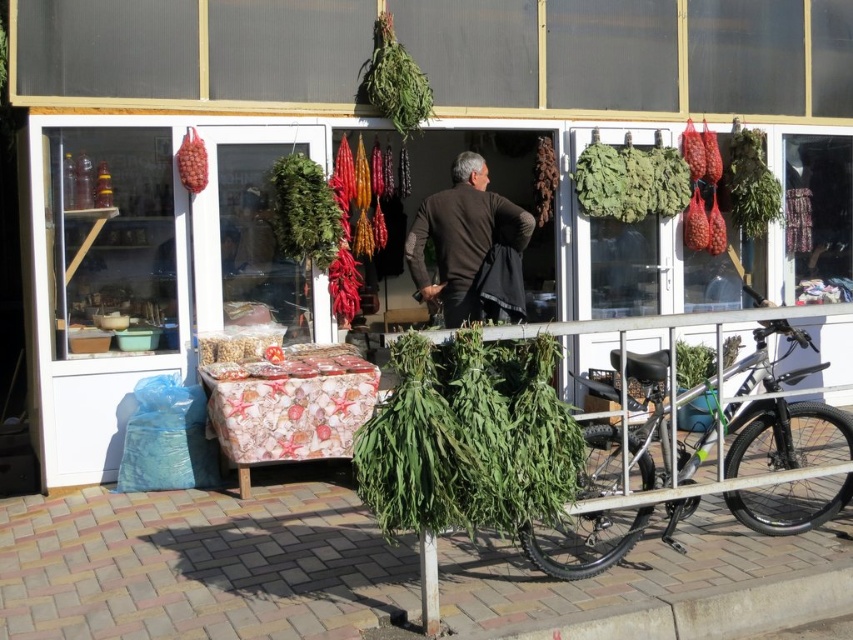
You are a customer standing in front of the market stall. You see the silver metallic bicycle at lower right and the brown woolen jacket at center. Which object is closer to the ground?

The silver metallic bicycle at lower right is located below the brown woolen jacket at center, so it is closer to the ground.

You are a customer standing in front of the market stall. You want to buy the matte red grapes at upper left but need to reach them. Is the silver metallic bicycle at lower right blocking your path to the grapes?

The silver metallic bicycle at lower right is in front of matte red grapes at upper left, so it is blocking your path to the grapes.